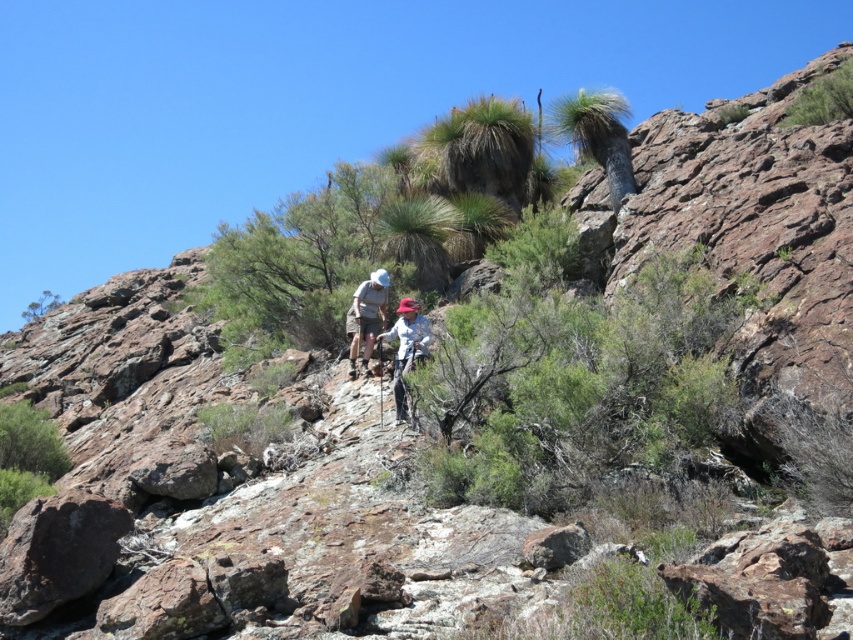
You are a hiker who wants to identify clothing items in the scene. Which clothing item is positioned higher up between the light brown fabric shirt at center and the white fabric at center?

The light brown fabric shirt at center is positioned higher up than the white fabric at center.

You are a hiker who wants to locate the light brown fabric shirt at center and the white fabric at center in the rocky hillside scene. According to the image, which one is positioned more to the left?

The light brown fabric shirt at center is positioned to the left of the white fabric at center, so the light brown fabric shirt at center is more to the left.